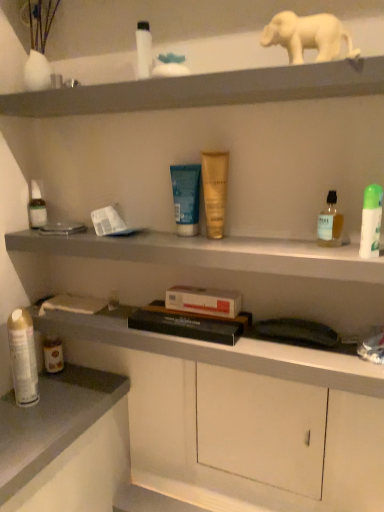
Identify the location of free space on the front side of metallic silver spray can at lower left, the 2th toiletry viewed from the back. The height and width of the screenshot is (512, 384). (24, 434).